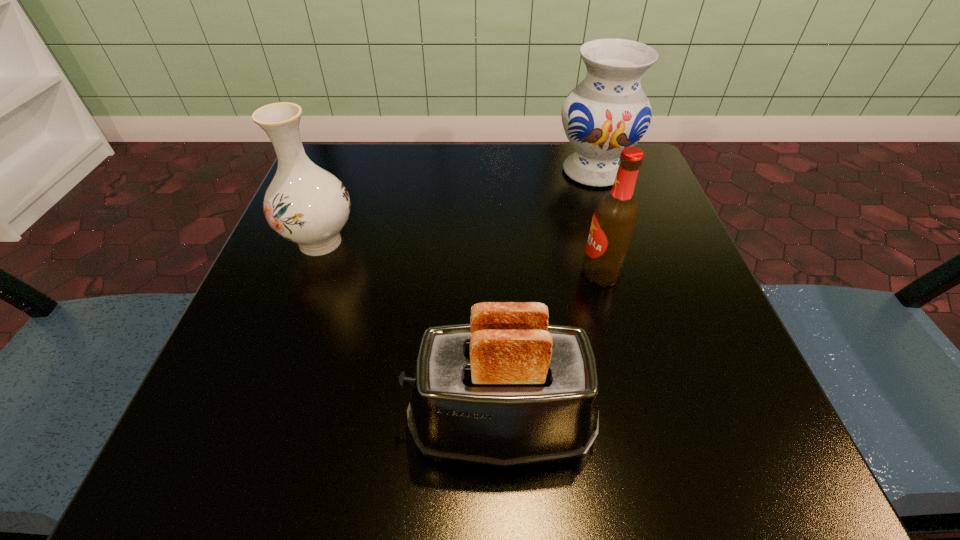
You are a GUI agent. You are given a task and a screenshot of the screen. Output one action in this format:
    pyautogui.click(x=<x>, y=<y>)
    Task: Click on the vacant space located on the side of the third object from right to left with the control lever
    The image size is (960, 540).
    Given the screenshot: What is the action you would take?
    pyautogui.click(x=228, y=426)

The image size is (960, 540). Find the location of `vacant area located on the side of the third object from right to left with the control lever`. vacant area located on the side of the third object from right to left with the control lever is located at coordinates (259, 426).

Identify the location of blank space located 0.090m on the side of the third object from right to left with the control lever. The width and height of the screenshot is (960, 540). (338, 426).

Identify the location of object at the far edge. (608, 111).

Locate an element on the screen. This screenshot has width=960, height=540. object at the near edge is located at coordinates [507, 389].

At what (x,y) coordinates should I click in order to perform the action: click on object at the left edge. Please return your answer as a coordinate pair (x, y). This screenshot has width=960, height=540. Looking at the image, I should click on point(304,203).

Find the location of a particular element. The height and width of the screenshot is (540, 960). vase that is at the right edge is located at coordinates (608, 111).

This screenshot has width=960, height=540. What are the coordinates of `beer bottle at the right edge` in the screenshot? It's located at point(614,220).

Where is `object present at the far right corner`? This screenshot has width=960, height=540. object present at the far right corner is located at coordinates (608, 111).

This screenshot has height=540, width=960. Identify the location of free space at the far edge of the desktop. (516, 146).